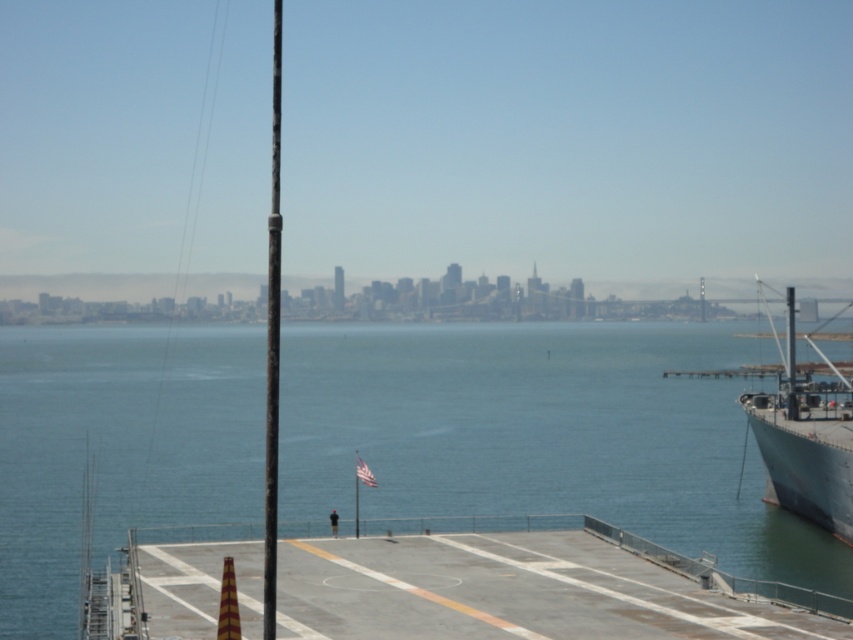
Question: Which of the following is the farthest from the observer?

Choices:
 (A) (491, 628)
 (B) (780, 480)
 (C) (357, 467)
 (D) (267, 323)

Answer: (B)

Question: Is gray metallic ship at right smaller than white fabric flag at center?

Choices:
 (A) no
 (B) yes

Answer: (A)

Question: Which object appears closest to the camera in this image?

Choices:
 (A) gray concrete deck at center
 (B) metallic flag pole at center

Answer: (A)

Question: Which point is farther to the camera?

Choices:
 (A) metallic flag pole at center
 (B) gray concrete deck at center

Answer: (A)

Question: Does blue water at center have a larger size compared to metallic flag pole at center?

Choices:
 (A) yes
 (B) no

Answer: (A)

Question: Is the position of metallic flag pole at center more distant than that of white fabric flag at center?

Choices:
 (A) no
 (B) yes

Answer: (A)